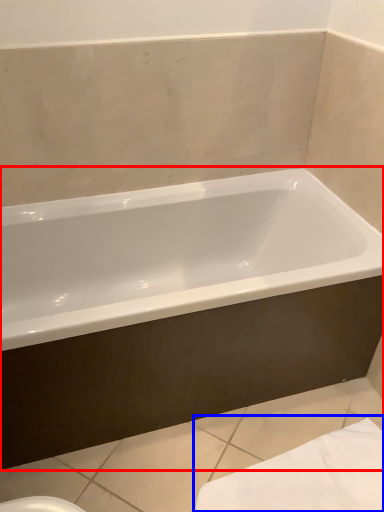
Question: Which object is further to the camera taking this photo, bathtub (highlighted by a red box) or bath towel (highlighted by a blue box)?

Choices:
 (A) bathtub
 (B) bath towel

Answer: (B)